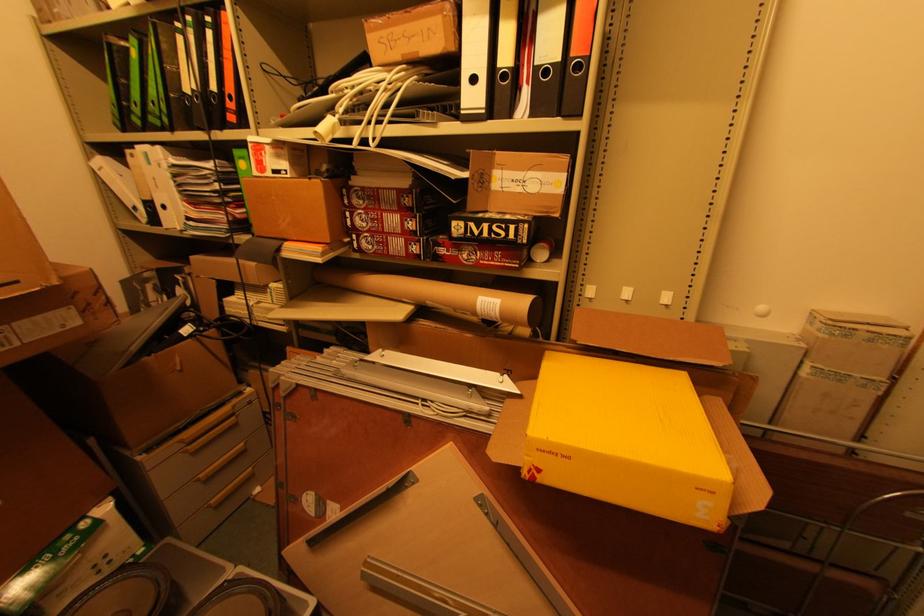
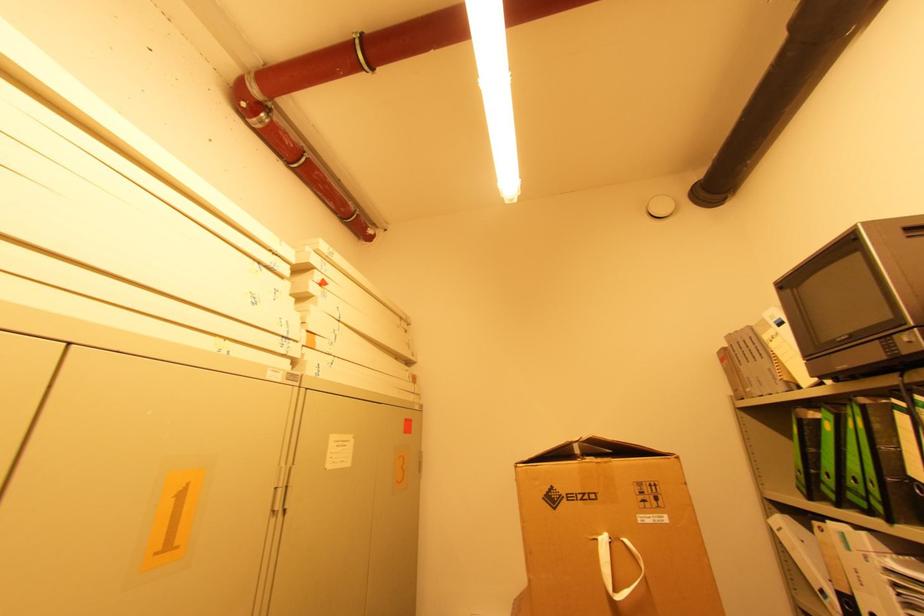
The point at (131,107) is marked in the first image. Where is the corresponding point in the second image?

(822, 476)